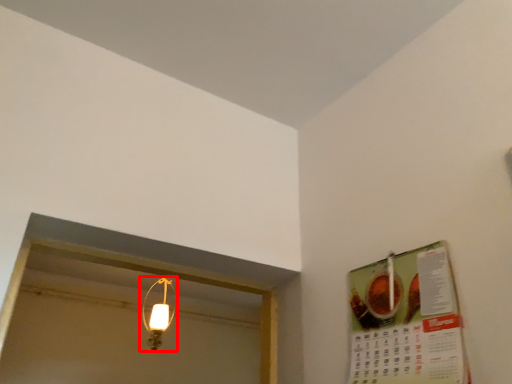
Question: Where is lamp (annotated by the red box) located in relation to menu in the image?

Choices:
 (A) left
 (B) right

Answer: (A)